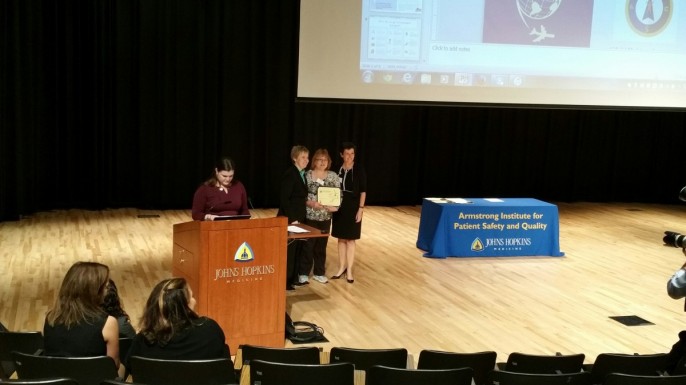
Find the location of a particular element. papers on the tabletop is located at coordinates (433, 197), (455, 197), (496, 198).